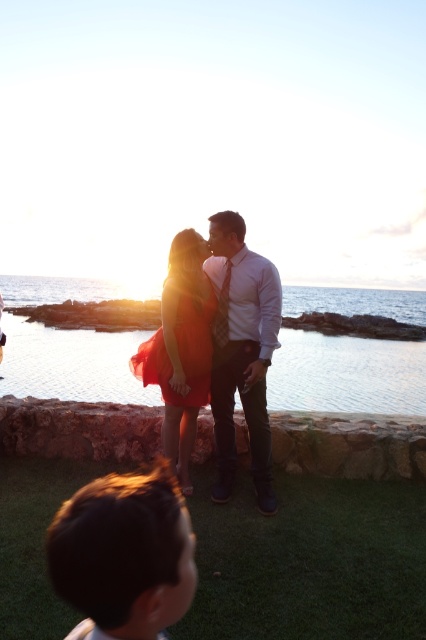
You are standing at the point with coordinates point (132, 365) and want to walk towards the point with coordinates point (249, 342). Which direction should you move relative to your current position?

Answer: You should move north relative to your current position because point (249, 342) is in front of point (132, 365).

You are a photographer trying to capture the couple in the sunset scene. You notice the matte white shirt at center and the satin red dress at center. Which clothing item appears narrower in the photo?

The matte white shirt at center appears narrower than the satin red dress at center because its width is less than that of the dress.

You are a photographer trying to capture the couple in the center of the image. According to the coordinates provided, where exactly should you focus your camera to ensure the matte white shirt at center is in the frame?

The matte white shirt at center is located at point (x=241, y=352), so you should focus your camera at those coordinates to ensure it is centered in the frame.